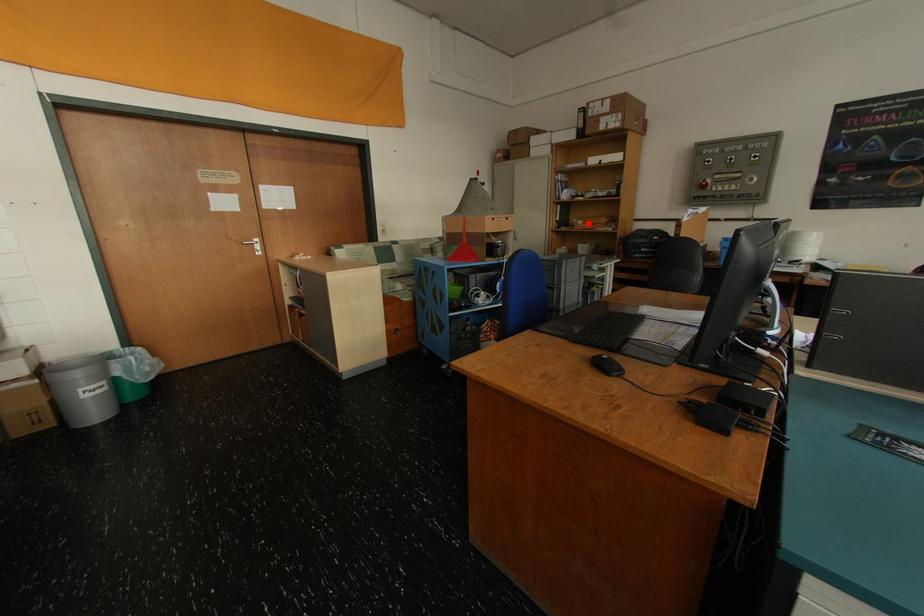
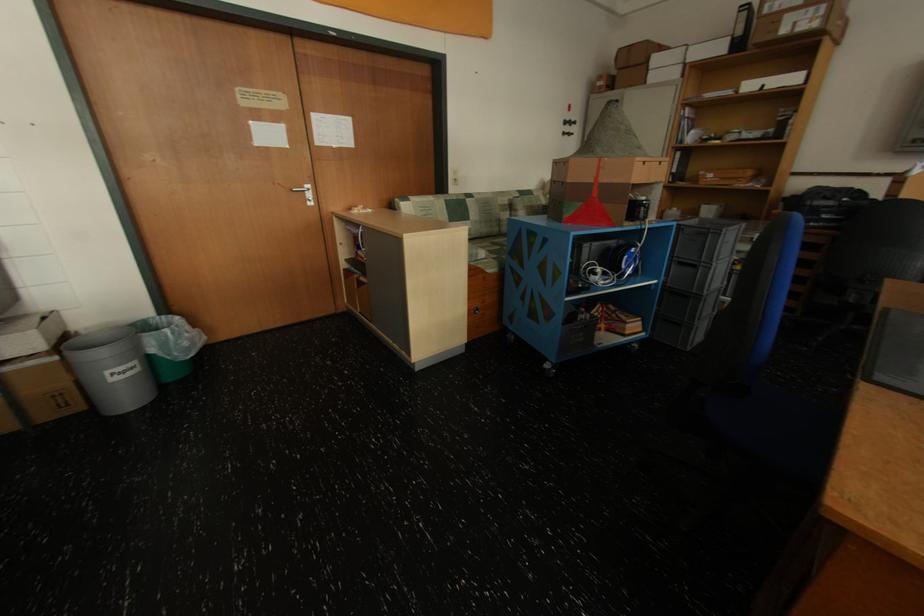
Question: I am providing you with two images of the same scene from different viewpoints. A red point is shown in image1. For the corresponding object point in image2, is it positioned nearer or farther from the camera?

Choices:
 (A) Nearer
 (B) Farther

Answer: (B)